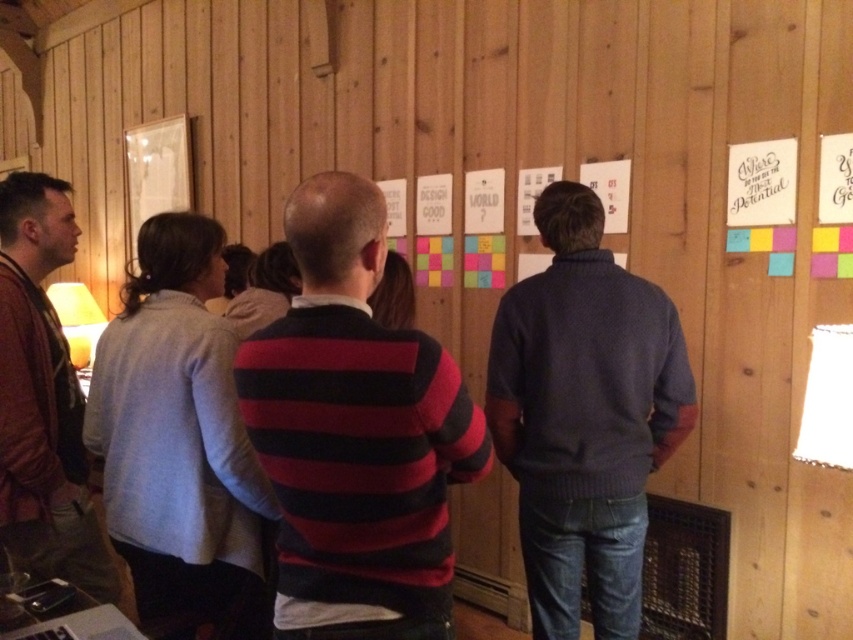
Where is the striped sweater at center located in the image?

The striped sweater at center is located at point (355,435) in the image.